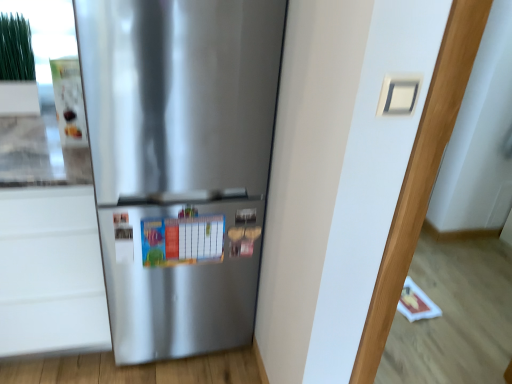
Question: Is white matte drawer at lower left not within white matte door at center?

Choices:
 (A) no
 (B) yes

Answer: (B)

Question: Are white matte drawer at lower left and white matte door at center making contact?

Choices:
 (A) no
 (B) yes

Answer: (A)

Question: Is white matte drawer at lower left taller than white matte door at center?

Choices:
 (A) yes
 (B) no

Answer: (B)

Question: Is white matte drawer at lower left to the left of white matte door at center from the viewer's perspective?

Choices:
 (A) no
 (B) yes

Answer: (B)

Question: Is white matte drawer at lower left positioned before white matte door at center?

Choices:
 (A) no
 (B) yes

Answer: (A)

Question: From their relative heights in the image, would you say white matte door at center is taller or shorter than satin silver refrigerator at center?

Choices:
 (A) short
 (B) tall

Answer: (B)

Question: Is point (408, 51) closer or farther from the camera than point (111, 205)?

Choices:
 (A) farther
 (B) closer

Answer: (B)

Question: In terms of width, does white matte door at center look wider or thinner when compared to satin silver refrigerator at center?

Choices:
 (A) wide
 (B) thin

Answer: (B)

Question: From the image's perspective, relative to satin silver refrigerator at center, is white matte door at center above or below?

Choices:
 (A) below
 (B) above

Answer: (A)

Question: Is point (342, 349) positioned closer to the camera than point (74, 274)?

Choices:
 (A) closer
 (B) farther

Answer: (A)

Question: Looking at their shapes, would you say white matte door at center is wider or thinner than white matte drawer at lower left?

Choices:
 (A) thin
 (B) wide

Answer: (A)

Question: Is white matte door at center in front of or behind white matte drawer at lower left in the image?

Choices:
 (A) behind
 (B) front

Answer: (B)

Question: Is white matte door at center spatially inside white matte drawer at lower left, or outside of it?

Choices:
 (A) outside
 (B) inside

Answer: (A)

Question: In terms of size, does white matte drawer at lower left appear bigger or smaller than satin silver refrigerator at center?

Choices:
 (A) big
 (B) small

Answer: (B)

Question: In the image, is white matte drawer at lower left positioned in front of or behind satin silver refrigerator at center?

Choices:
 (A) behind
 (B) front

Answer: (A)